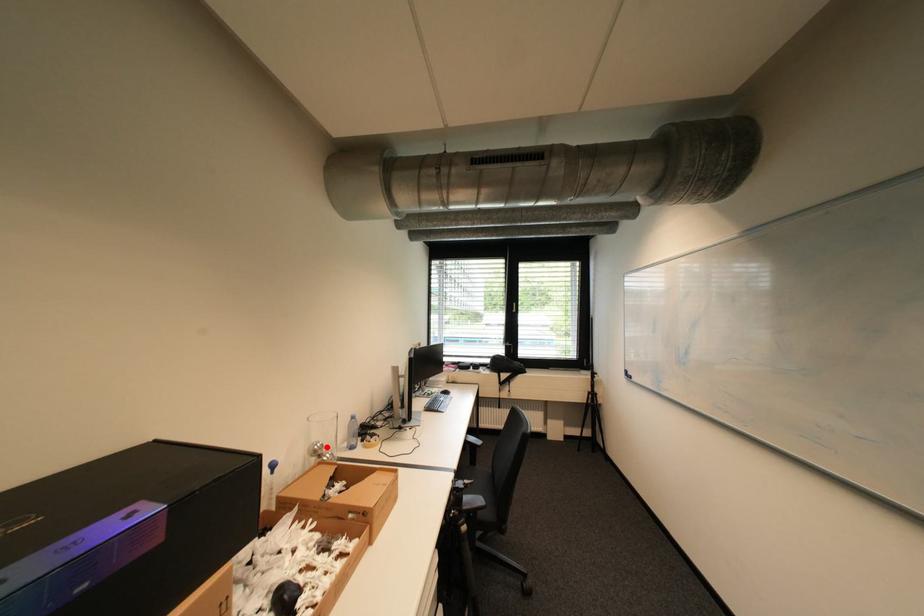
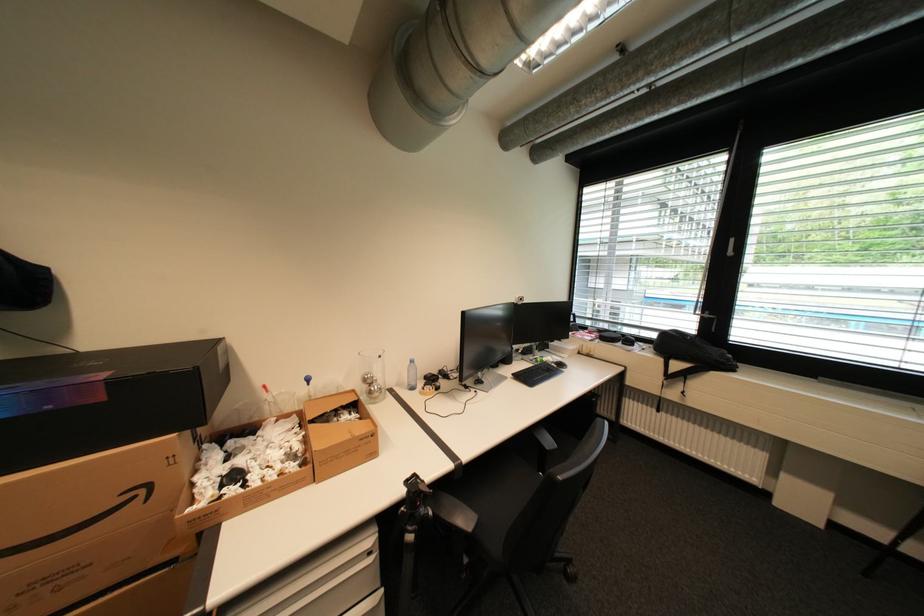
Where in the second image is the point corresponding to the highlighted location from the first image?

(377, 378)